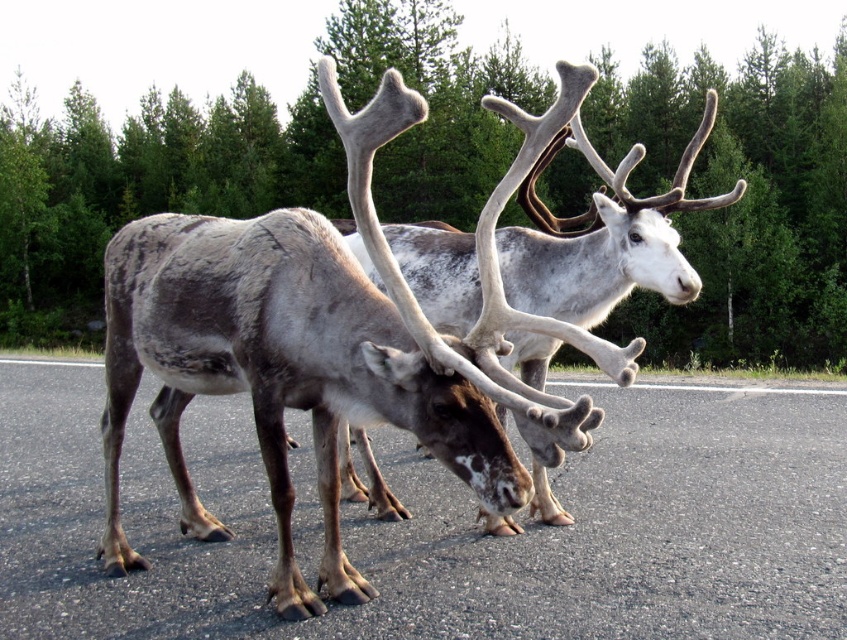
Can you confirm if grayish-brown fur reindeer at center is thinner than gray speckled fur at center?

No.

Does grayish-brown fur reindeer at center have a greater width compared to gray speckled fur at center?

Correct, the width of grayish-brown fur reindeer at center exceeds that of gray speckled fur at center.

Find the location of a particular element. The width and height of the screenshot is (847, 640). grayish-brown fur reindeer at center is located at coordinates (299, 353).